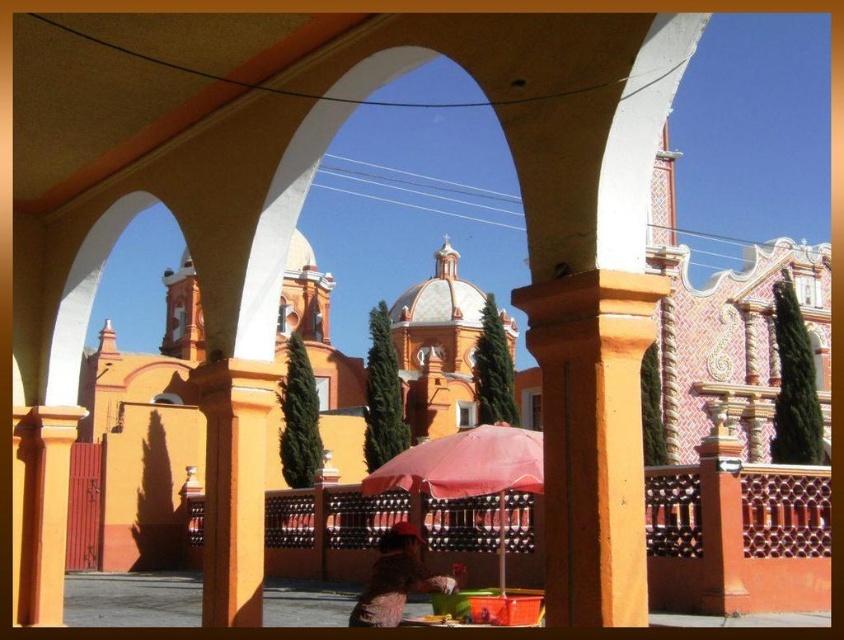
Question: Which object appears farthest from the camera in this image?

Choices:
 (A) pink fabric umbrella at center
 (B) orange stucco column at center
 (C) orange painted pillar at center
 (D) pink fabric umbrella at lower center

Answer: (C)

Question: Is matte orange column at center smaller than pink fabric umbrella at lower center?

Choices:
 (A) no
 (B) yes

Answer: (A)

Question: Which object is the closest to the orange painted pillar at center?

Choices:
 (A) matte orange column at center
 (B) orange stucco column at center
 (C) pink fabric umbrella at lower center

Answer: (A)

Question: Does orange painted pillar at center appear on the right side of pink fabric umbrella at center?

Choices:
 (A) no
 (B) yes

Answer: (A)

Question: Is orange stucco column at center wider than matte orange column at center?

Choices:
 (A) no
 (B) yes

Answer: (A)

Question: Which object is farther from the camera taking this photo?

Choices:
 (A) orange painted pillar at center
 (B) pink fabric umbrella at lower center
 (C) pink fabric umbrella at center

Answer: (A)